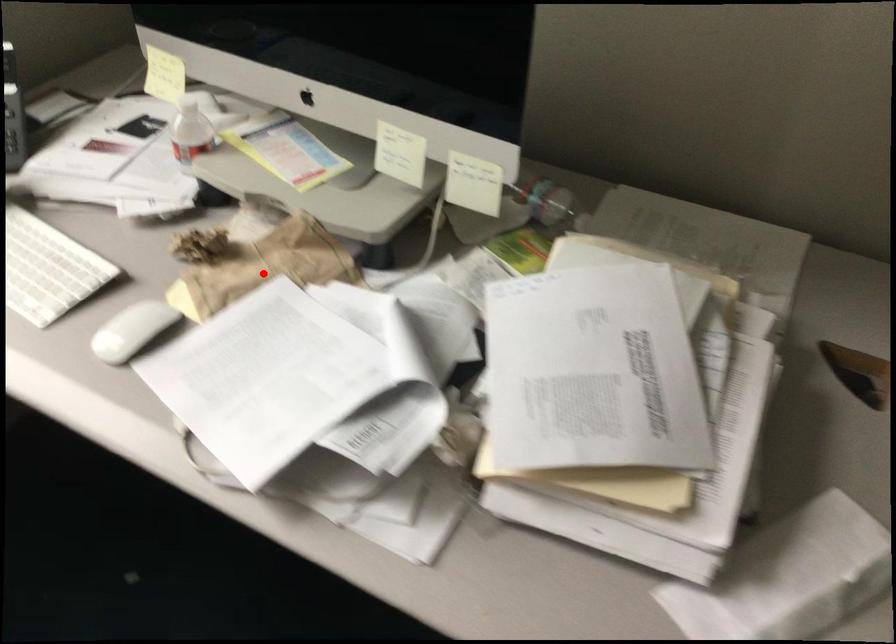
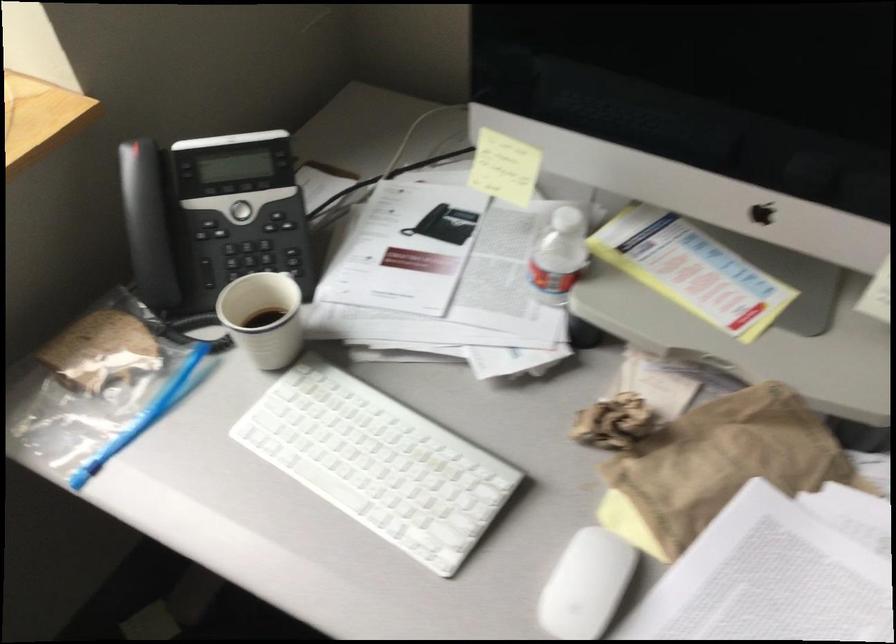
Where in the second image is the point corresponding to the highlighted location from the first image?

(718, 466)